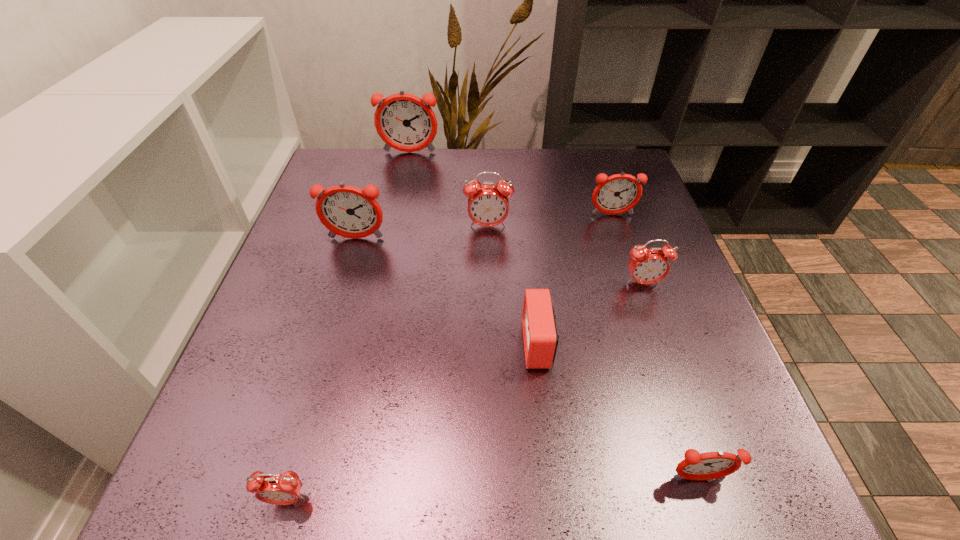
The height and width of the screenshot is (540, 960). In the image, there is a desktop. In order to click on vacant region at the left edge in this screenshot , I will do `click(326, 301)`.

Identify the location of vacant region at the right edge of the desktop. The image size is (960, 540). (648, 200).

Image resolution: width=960 pixels, height=540 pixels. In the image, there is a desktop. Find the location of `vacant space at the far left corner`. vacant space at the far left corner is located at coordinates (345, 156).

Locate an element on the screen. vacant space at the near right corner of the desktop is located at coordinates (744, 475).

Locate an element on the screen. free space that is in between the third smallest reddish-pink alarm clock and the third nearest reddish-pink alarm clock is located at coordinates (484, 227).

The height and width of the screenshot is (540, 960). I want to click on vacant area between the third biggest reddish-pink alarm clock and the seventh farthest object, so click(655, 347).

I want to click on unoccupied position between the nearest alarm clock and the seventh nearest object, so click(449, 357).

I want to click on free area in between the sixth farthest object and the third smallest red alarm clock, so click(590, 314).

I want to click on unoccupied area between the farthest reddish-pink alarm clock and the fourth object from right to left, so click(474, 248).

You are a GUI agent. You are given a task and a screenshot of the screen. Output one action in this format:
    pyautogui.click(x=<x>, y=<y>)
    Task: Click on the vacant area that lies between the leftmost red alarm clock and the sixth nearest object
    This screenshot has width=960, height=540.
    Given the screenshot: What is the action you would take?
    pyautogui.click(x=388, y=363)